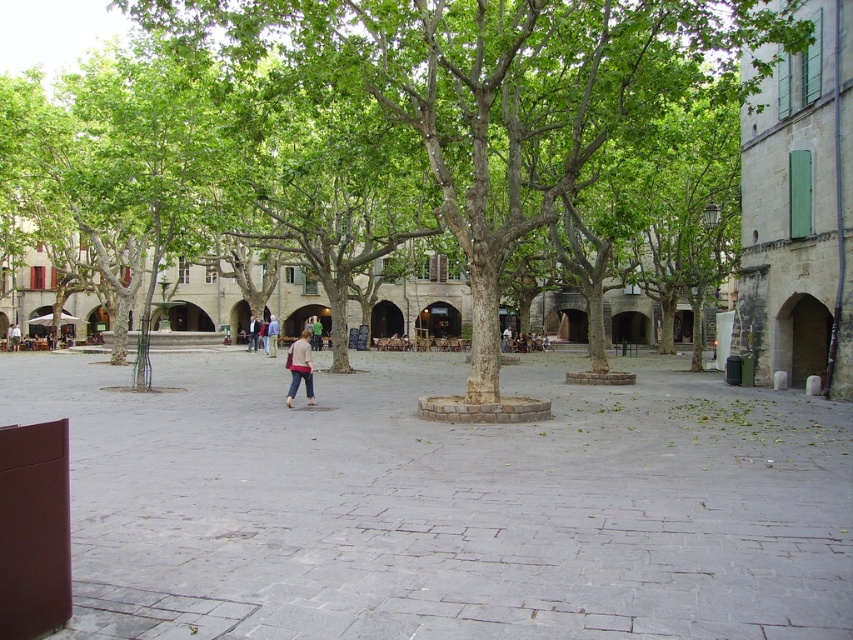
You are a delivery person carrying a box that is 3 meters long. You need to move from the gray stone courtyard at lower left to the pink fabric pants at center. Is there enough space for your box to fit through the path between them?

The distance between the gray stone courtyard at lower left and the pink fabric pants at center is 5.46 meters. Since the box is 3 meters long, there is enough space for the box to fit through the path between them.